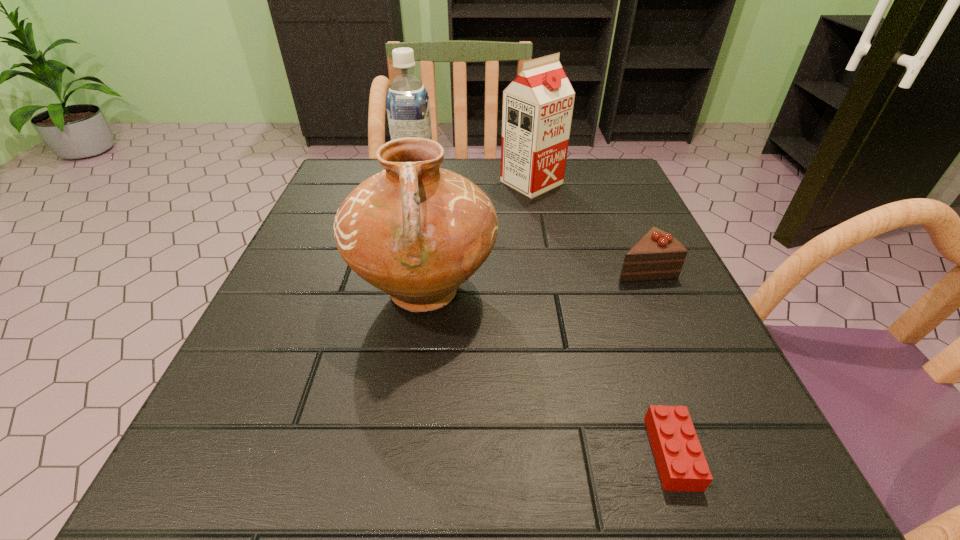
In order to click on free space between the right soya milk and the nearest object in this screenshot , I will do `click(602, 318)`.

Where is `empty space between the left soya milk and the nearest object`? empty space between the left soya milk and the nearest object is located at coordinates (544, 318).

Where is `free spot between the pottery and the chocolate cake`? This screenshot has height=540, width=960. free spot between the pottery and the chocolate cake is located at coordinates (534, 279).

The image size is (960, 540). Identify the location of vacant area between the Lego and the chocolate cake. (658, 360).

You are a GUI agent. You are given a task and a screenshot of the screen. Output one action in this format:
    pyautogui.click(x=<x>, y=<y>)
    Task: Click on the vacant area that lies between the third object from right to left and the second shortest object
    This screenshot has width=960, height=540.
    Given the screenshot: What is the action you would take?
    pyautogui.click(x=588, y=225)

What are the coordinates of `the third closest object to the third object from right to left` in the screenshot? It's located at (657, 255).

Select which object appears as the closest to the left soya milk. Please provide its 2D coordinates. Your answer should be formatted as a tuple, i.e. [(x, y)], where the tuple contains the x and y coordinates of a point satisfying the conditions above.

[(538, 104)]

Where is `free location that satisfies the following two spatial constraints: 1. on the side of the pottery with the handle; 2. on the left side of the nearest object`? This screenshot has height=540, width=960. free location that satisfies the following two spatial constraints: 1. on the side of the pottery with the handle; 2. on the left side of the nearest object is located at coordinates (402, 453).

The image size is (960, 540). Identify the location of free space that satisfies the following two spatial constraints: 1. on the label of the nearest object; 2. on the left side of the left soya milk. click(357, 453).

At what (x,y) coordinates should I click in order to perform the action: click on vacant point that satisfies the following two spatial constraints: 1. on the label of the chocolate cake; 2. on the right side of the left soya milk. Please return your answer as a coordinate pair (x, y). The height and width of the screenshot is (540, 960). Looking at the image, I should click on (397, 268).